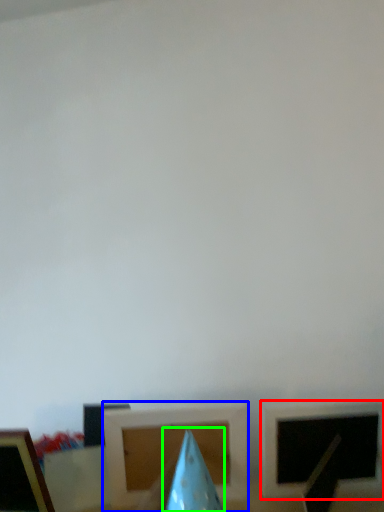
Question: Based on their relative distances, which object is nearer to picture frame (highlighted by a red box)? Choose from picture frame (highlighted by a blue box) and exhaust hood (highlighted by a green box).

Choices:
 (A) picture frame
 (B) exhaust hood

Answer: (A)